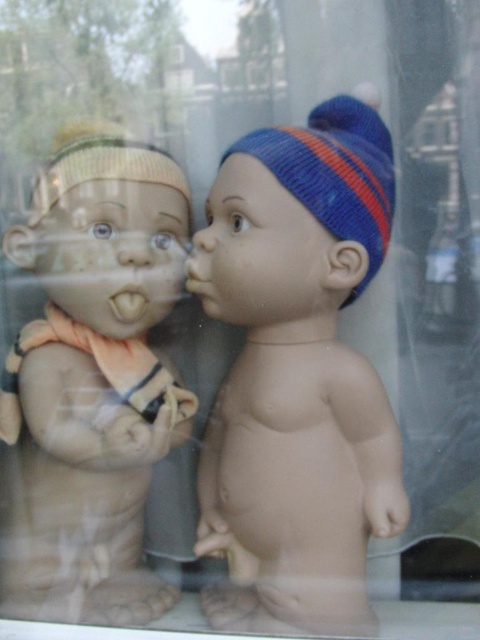
Question: Which object appears farthest from the camera in this image?

Choices:
 (A) matte plastic baby at center
 (B) knitted blue and orange hat at center
 (C) smooth beige nose at center
 (D) matte porcelain doll at left

Answer: (C)

Question: Among these objects, which one is nearest to the camera?

Choices:
 (A) matte plastic baby at center
 (B) knitted blue and orange hat at center
 (C) matte porcelain doll at left
 (D) matte plastic nose at center

Answer: (B)

Question: Does matte plastic baby at center appear under smooth beige nose at center?

Choices:
 (A) yes
 (B) no

Answer: (A)

Question: Which object is closer to the camera taking this photo?

Choices:
 (A) matte porcelain doll at left
 (B) knitted blue and orange hat at center
 (C) matte plastic nose at center

Answer: (B)

Question: Is smooth beige nose at center further to camera compared to matte plastic nose at center?

Choices:
 (A) no
 (B) yes

Answer: (B)

Question: Is knitted blue and orange hat at center below matte plastic nose at center?

Choices:
 (A) yes
 (B) no

Answer: (B)